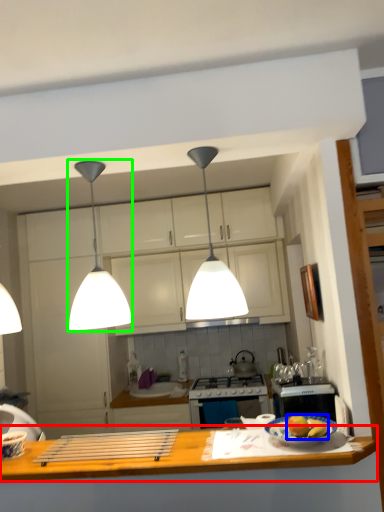
Question: Based on their relative distances, which object is nearer to countertop (highlighted by a red box)? Choose from apple (highlighted by a blue box) and light (highlighted by a green box).

Choices:
 (A) apple
 (B) light

Answer: (A)